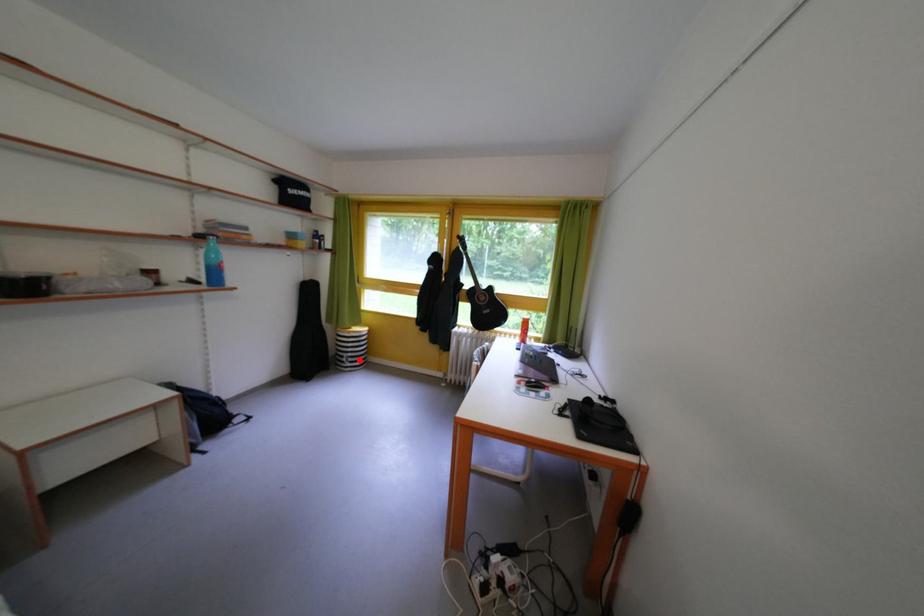
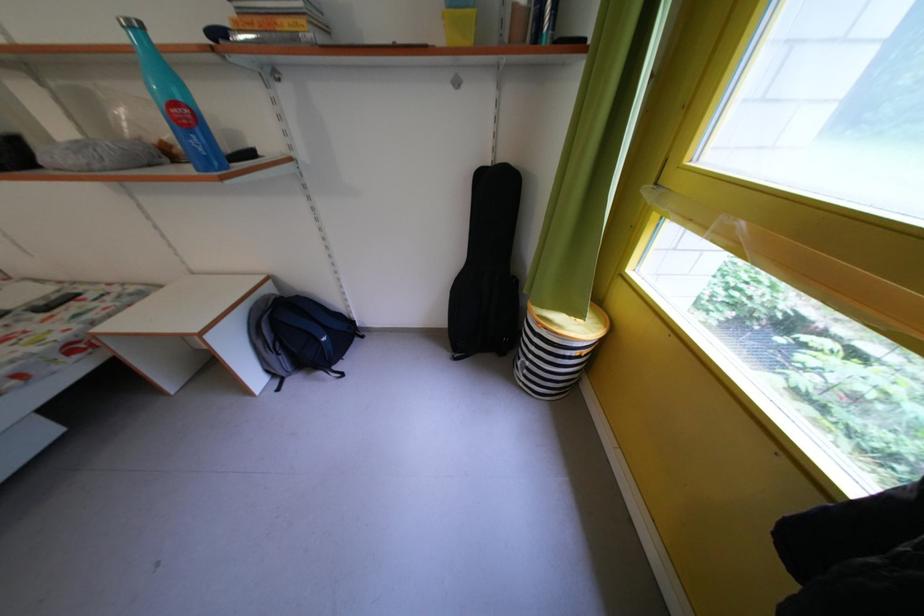
Locate, in the second image, the point that corresponds to the highlighted location in the first image.

(537, 369)